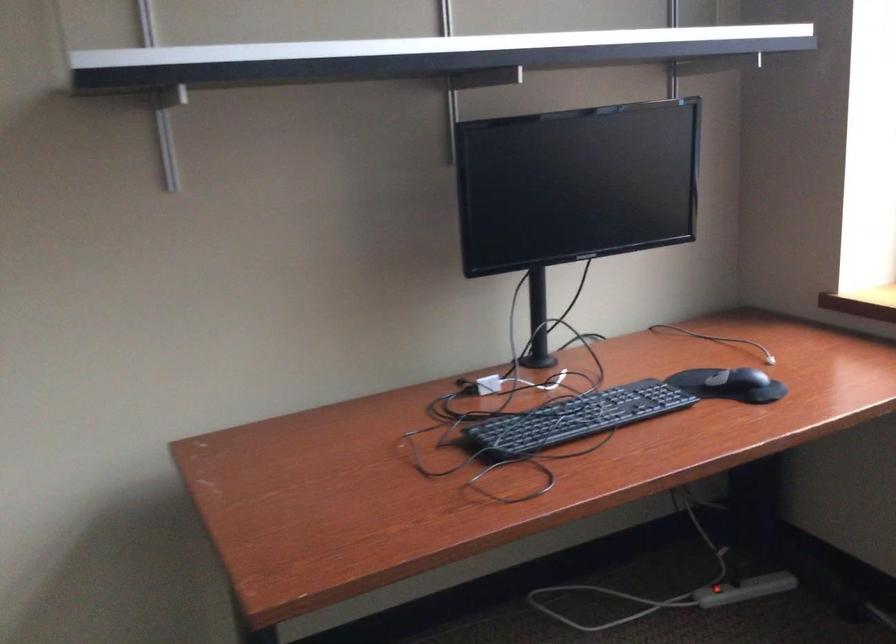
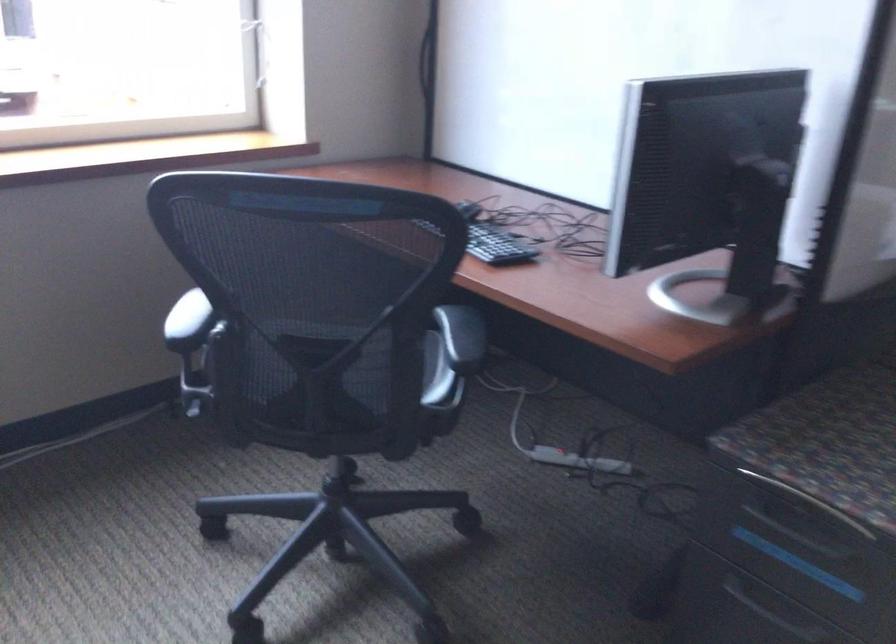
The images are taken continuously from a first-person perspective. In which direction is your viewpoint rotating?

The camera's rotation is toward right-down.